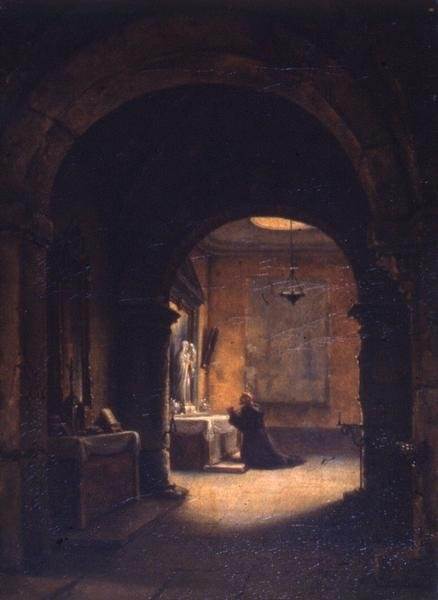
At what (x,y) coordinates should I click in order to perform the action: click on book. Please return your answer as a coordinate pair (x, y). This screenshot has height=600, width=438. Looking at the image, I should click on (109, 417).